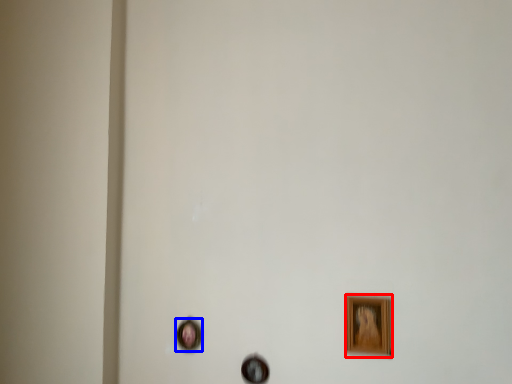
Question: Which point is further to the camera, picture frame (highlighted by a red box) or picture frame (highlighted by a blue box)?

Choices:
 (A) picture frame
 (B) picture frame

Answer: (B)